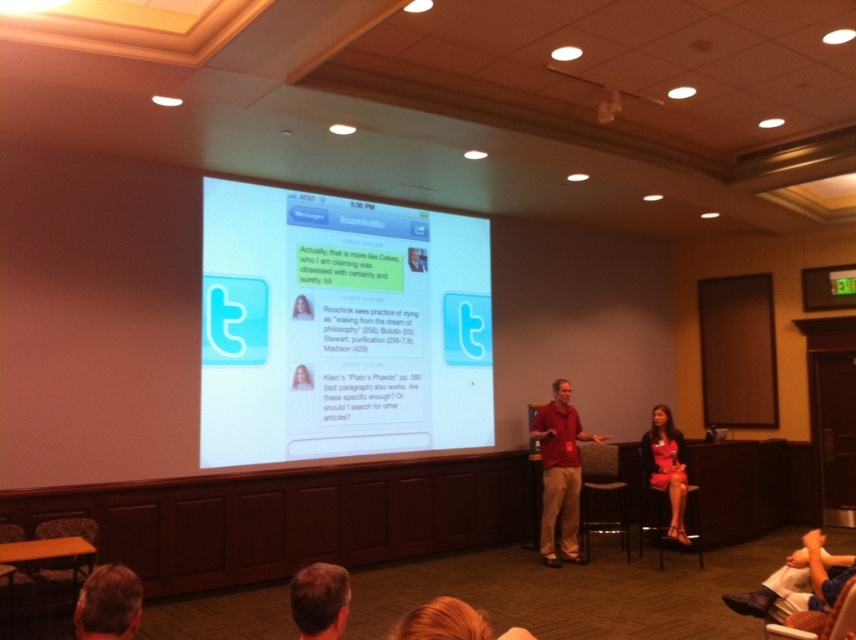
Between point (476, 330) and point (571, 483), which one is positioned in front?

Point (571, 483) is in front.

Find the location of a particular element. white glossy projection screen at center is located at coordinates (339, 326).

Does point (479, 337) come in front of point (556, 563)?

No, (479, 337) is behind (556, 563).

Where is `white glossy projection screen at center`? The width and height of the screenshot is (856, 640). white glossy projection screen at center is located at coordinates (339, 326).

Which is below, blonde hair at lower left or light brown hair at lower center?

Positioned lower is blonde hair at lower left.

Can you confirm if blonde hair at lower left is bigger than light brown hair at lower center?

Indeed, blonde hair at lower left has a larger size compared to light brown hair at lower center.

What do you see at coordinates (108, 604) in the screenshot? This screenshot has width=856, height=640. I see `blonde hair at lower left` at bounding box center [108, 604].

The width and height of the screenshot is (856, 640). I want to click on blonde hair at lower left, so click(108, 604).

Which is in front, point (349, 268) or point (661, 456)?

Point (349, 268) is more forward.

Does white glossy projection screen at center appear over matte pink dress at lower right?

Yes, white glossy projection screen at center is above matte pink dress at lower right.

Who is more distant from viewer, [370,444] or [642,449]?

Positioned behind is point [642,449].

In order to click on white glossy projection screen at center in this screenshot , I will do `click(339, 326)`.